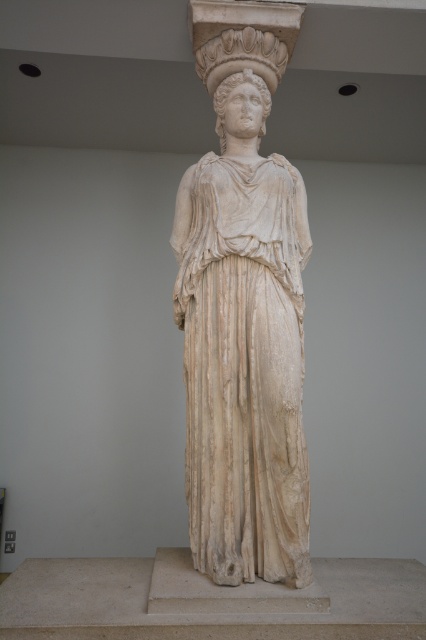
You are an art conservator assessing the dimensions of the statue. You need to determine if the white marble statue at center can fit through a doorway that is 1.5 meters wide. The white marble head at center is 0.5 meters wide. Can the statue pass through the doorway?

The white marble statue at center is wider than the white marble head at center, which is 0.5 meters wide. Since the statue is wider than the head, its width exceeds 0.5 meters. However, without knowing the exact width of the statue, we cannot definitively determine if it can pass through the 1.5 meter wide doorway. Additional measurements are needed.

You are an art conservator examining the statue from a specific viewpoint. You notice two points marked on the statue at coordinates point (264, 29) and point (239, 76). Which point is closer to your current viewpoint?

Point (264, 29) is in front of point (239, 76), so it is closer to your viewpoint.